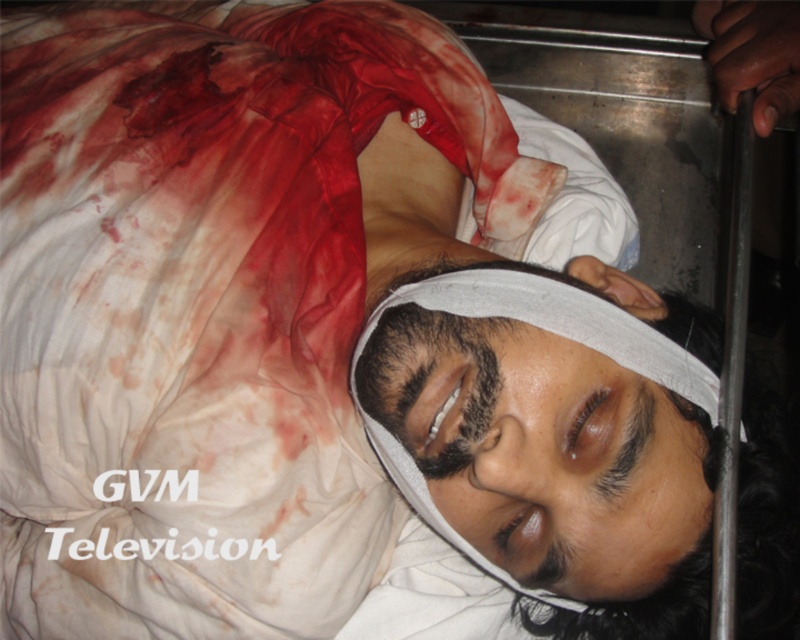
Question: Can you confirm if white bandage at center is positioned to the left of dry skin forehead at center?

Choices:
 (A) yes
 (B) no

Answer: (B)

Question: Which of the following is the closest to the observer?

Choices:
 (A) (714, 374)
 (B) (420, 314)

Answer: (B)

Question: Which of the following is the farthest from the observer?

Choices:
 (A) (570, 326)
 (B) (420, 328)

Answer: (B)

Question: Where is white bandage at center located in relation to dry skin forehead at center in the image?

Choices:
 (A) left
 (B) right

Answer: (B)

Question: Considering the relative positions of white bandage at center and dry skin forehead at center in the image provided, where is white bandage at center located with respect to dry skin forehead at center?

Choices:
 (A) above
 (B) below

Answer: (B)